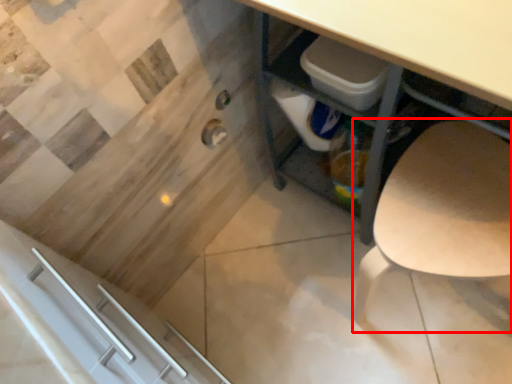
Question: From the image's perspective, where is chair (annotated by the red box) located in relation to desk in the image?

Choices:
 (A) above
 (B) below

Answer: (B)